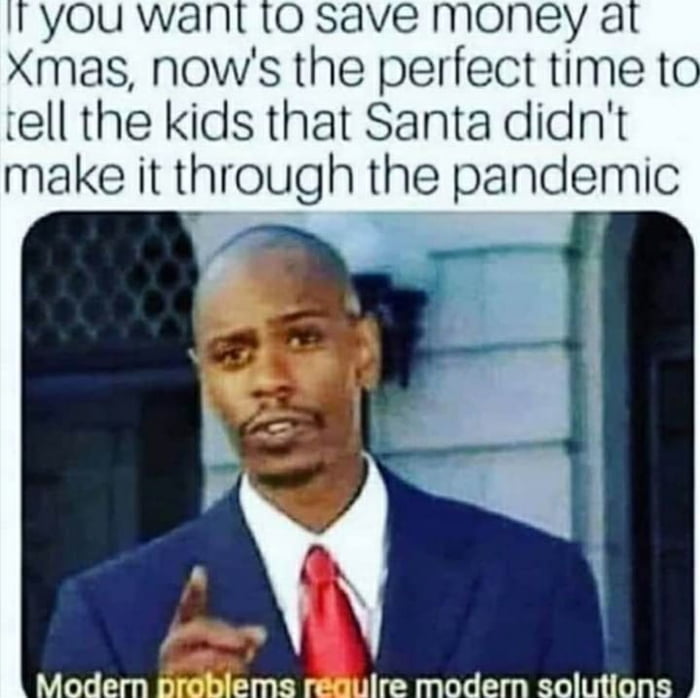
Where is `lights`? This screenshot has height=698, width=700. lights is located at coordinates (382, 259), (412, 267).